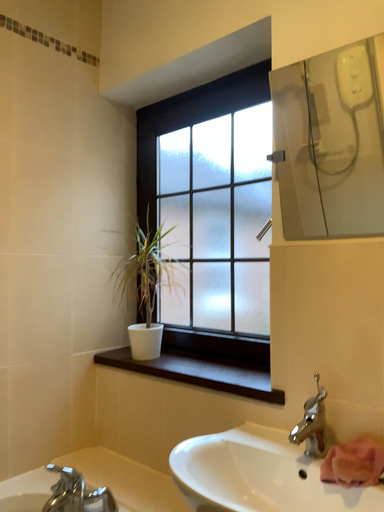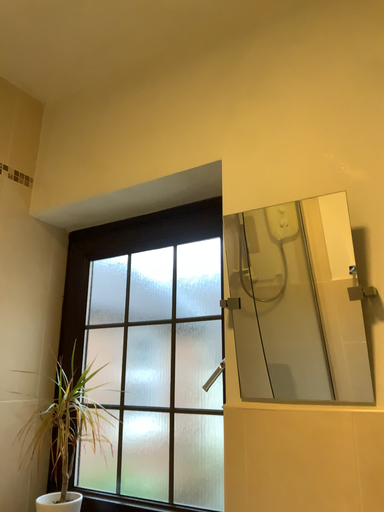
Question: How did the camera likely rotate when shooting the video?

Choices:
 (A) rotated upward
 (B) rotated downward

Answer: (A)